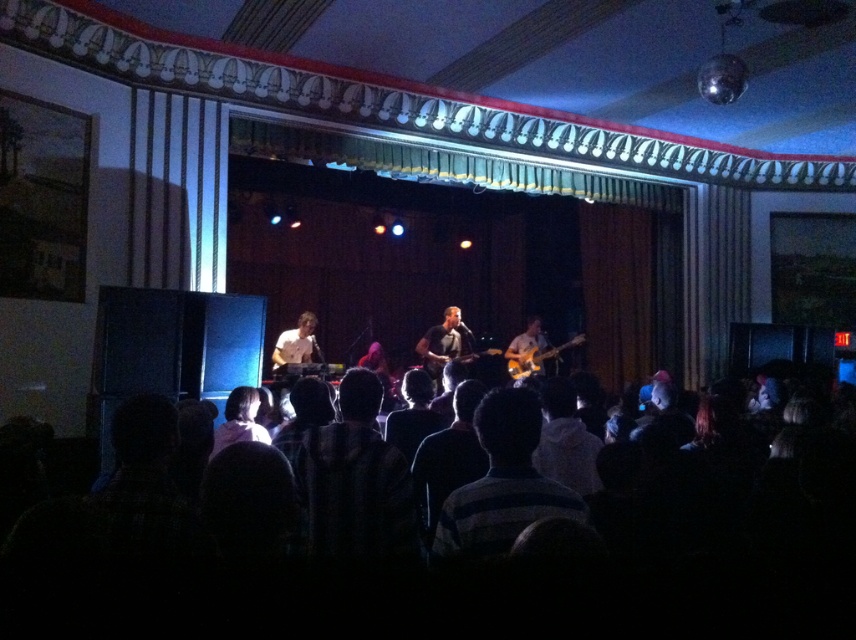
Does striped cotton shirt at center appear under orange glossy electric guitar at center?

Actually, striped cotton shirt at center is above orange glossy electric guitar at center.

Is point (518, 435) positioned before point (515, 362)?

Yes, point (518, 435) is in front of point (515, 362).

Between point (496, 456) and point (507, 368), which one is positioned behind?

The point (507, 368) is behind.

Locate an element on the screen. This screenshot has width=856, height=640. striped cotton shirt at center is located at coordinates (502, 483).

Is dark fabric crowd at lower center below orange glossy electric guitar at center?

Indeed, dark fabric crowd at lower center is positioned under orange glossy electric guitar at center.

Can you confirm if dark fabric crowd at lower center is smaller than orange glossy electric guitar at center?

Actually, dark fabric crowd at lower center might be larger than orange glossy electric guitar at center.

The height and width of the screenshot is (640, 856). What do you see at coordinates (411, 563) in the screenshot? I see `dark fabric crowd at lower center` at bounding box center [411, 563].

At what (x,y) coordinates should I click in order to perform the action: click on dark fabric crowd at lower center. Please return your answer as a coordinate pair (x, y). The width and height of the screenshot is (856, 640). Looking at the image, I should click on (411, 563).

Can you confirm if dark fabric crowd at lower center is wider than striped cotton shirt at center?

Yes.

Measure the distance from dark fabric crowd at lower center to striped cotton shirt at center.

dark fabric crowd at lower center and striped cotton shirt at center are 11.53 inches apart.

You are a GUI agent. You are given a task and a screenshot of the screen. Output one action in this format:
    pyautogui.click(x=<x>, y=<y>)
    Task: Click on the dark fabric crowd at lower center
    This screenshot has width=856, height=640.
    Given the screenshot: What is the action you would take?
    pos(411,563)

The width and height of the screenshot is (856, 640). What are the coordinates of `dark fabric crowd at lower center` in the screenshot? It's located at (411, 563).